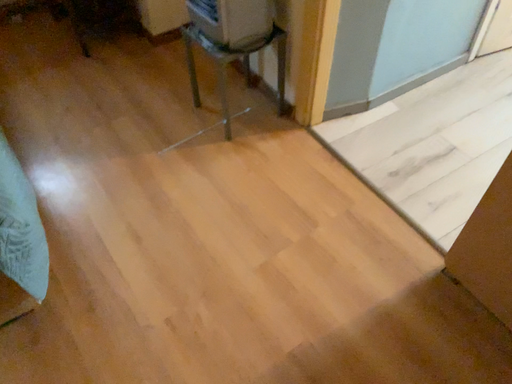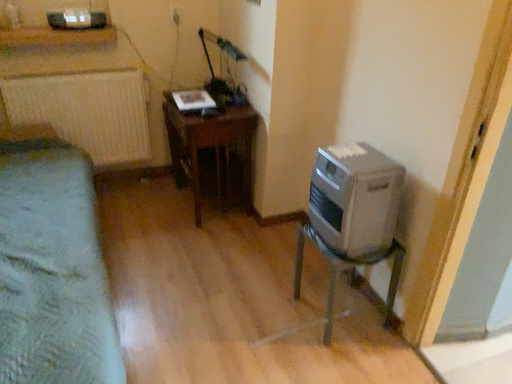
Question: How did the camera likely rotate when shooting the video?

Choices:
 (A) rotated downward
 (B) rotated upward

Answer: (B)